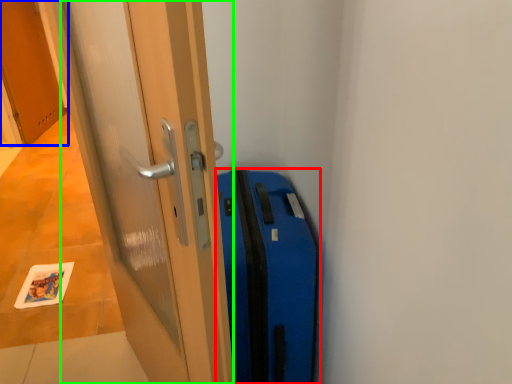
Question: Estimate the real-world distances between objects in this image. Which object is farther from suitcase (highlighted by a red box), door (highlighted by a blue box) or door (highlighted by a green box)?

Choices:
 (A) door
 (B) door

Answer: (A)